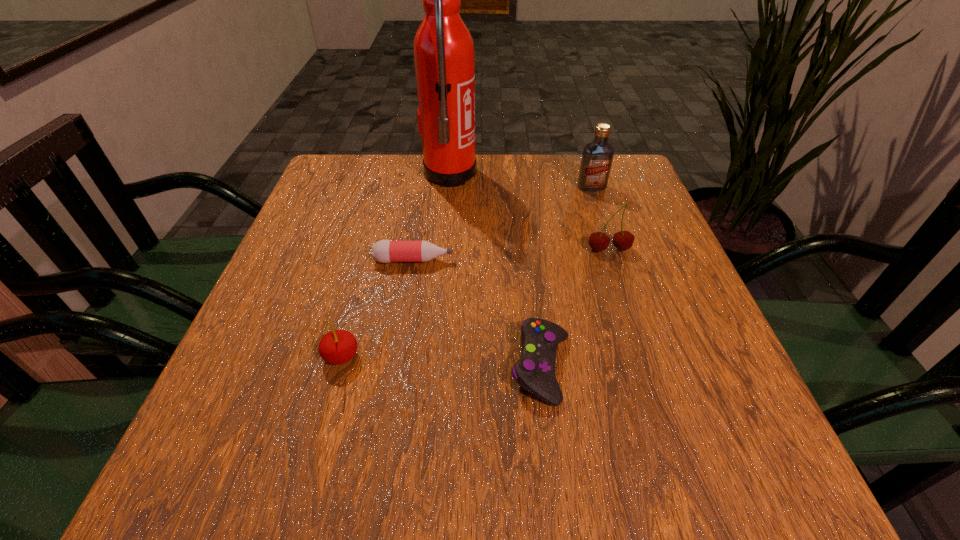
Find the location of a particular element. The height and width of the screenshot is (540, 960). blank area located on the left of the control is located at coordinates (407, 367).

This screenshot has height=540, width=960. Find the location of `vacant region located with the cap open on the bottle`. vacant region located with the cap open on the bottle is located at coordinates (496, 260).

Image resolution: width=960 pixels, height=540 pixels. I want to click on fire extinguisher positioned at the far edge, so click(444, 56).

Identify the location of vodka at the far edge. (597, 157).

Find the location of a particular element. This screenshot has width=960, height=540. object present at the left edge is located at coordinates (337, 347).

Image resolution: width=960 pixels, height=540 pixels. I want to click on vodka at the right edge, so click(x=597, y=157).

Locate an element on the screen. This screenshot has width=960, height=540. cherry that is at the right edge is located at coordinates (623, 240).

Identify the location of object located in the far right corner section of the desktop. This screenshot has height=540, width=960. (597, 157).

Image resolution: width=960 pixels, height=540 pixels. I want to click on vacant region at the far edge of the desktop, so click(x=542, y=183).

You are a GUI agent. You are given a task and a screenshot of the screen. Output one action in this format:
    pyautogui.click(x=<x>, y=<y>)
    Task: Click on the free space at the near edge
    The width and height of the screenshot is (960, 540).
    Given the screenshot: What is the action you would take?
    pyautogui.click(x=416, y=456)